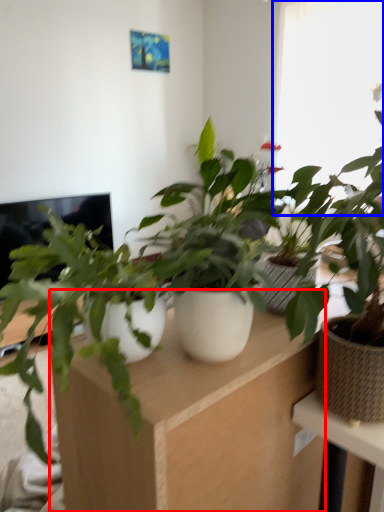
Question: Which object is closer to the camera taking this photo, computer desk (highlighted by a red box) or window (highlighted by a blue box)?

Choices:
 (A) computer desk
 (B) window

Answer: (A)